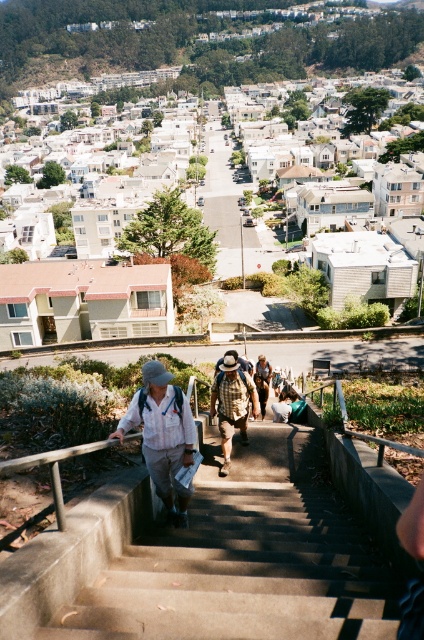
You are standing at the top of the steep staircase in the residential area. You notice two points marked on the image, one at coordinate point (292, 452) and another at point (237, 364). If you want to walk towards the point that is closer to you, which coordinate should you head towards?

You should head towards point (292, 452) because it is closer to the camera than point (237, 364), which means it is nearer to your current position at the top of the staircase.

From the picture: You are standing at the top of the concrete stairs at center. You want to walk down to the street below. Which direction should you go to reach the street?

You should go down the concrete stairs at center to reach the street below.

Looking at this image, you are standing at the top of the steep staircase in the residential area. You see a white cotton shirt at center. Where exactly is the white cotton shirt located in relation to the staircase?

The white cotton shirt at center is located at point 0.681 on the x axis and point 0.384 on the y axis relative to the staircase.